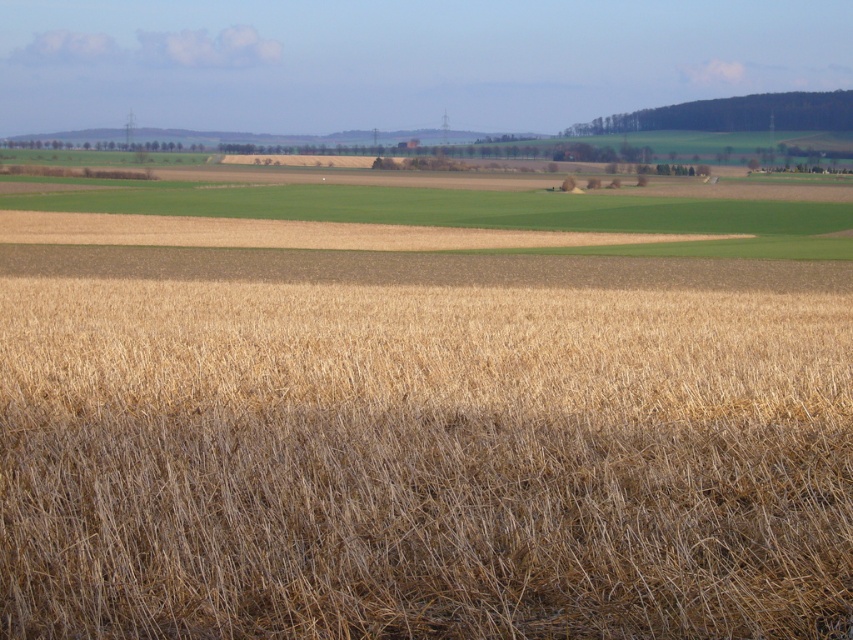
Question: Can you confirm if dry straw field at center is positioned below brown grassland at center?

Choices:
 (A) yes
 (B) no

Answer: (A)

Question: Can you confirm if dry straw field at center is positioned to the left of brown grassland at center?

Choices:
 (A) no
 (B) yes

Answer: (B)

Question: Which object appears closest to the camera in this image?

Choices:
 (A) dry straw field at center
 (B) brown grassland at center

Answer: (A)

Question: Which of the following is the closest to the observer?

Choices:
 (A) dry straw field at center
 (B) brown grassland at center

Answer: (A)

Question: Is dry straw field at center further to the viewer compared to brown grassland at center?

Choices:
 (A) yes
 (B) no

Answer: (B)